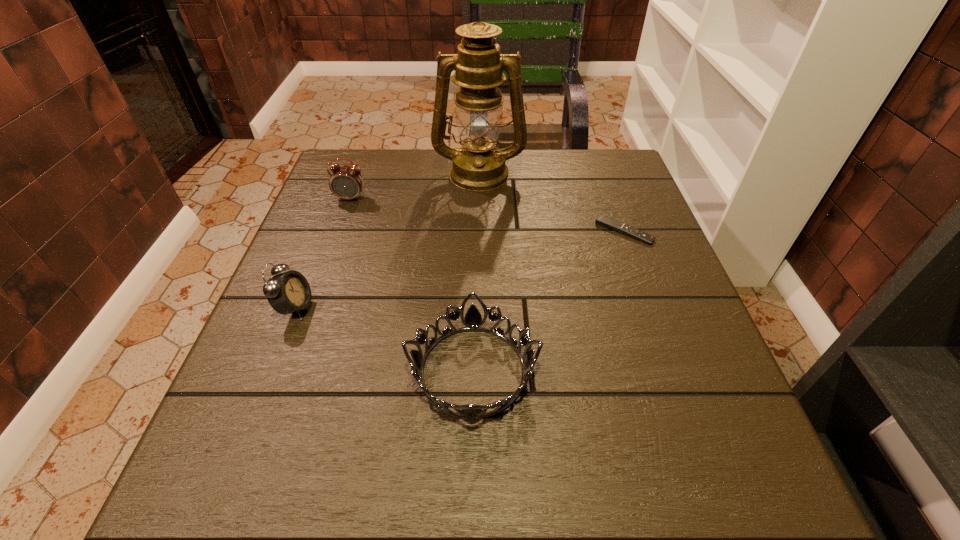
Locate an element on the screen. The height and width of the screenshot is (540, 960). free spot between the second shortest object and the tallest object is located at coordinates (476, 272).

Select which object appears as the third closest to the shortest object. Please provide its 2D coordinates. Your answer should be formatted as a tuple, i.e. [(x, y)], where the tuple contains the x and y coordinates of a point satisfying the conditions above.

[(346, 182)]

Choose which object is the fourth nearest neighbor to the tallest object. Please provide its 2D coordinates. Your answer should be formatted as a tuple, i.e. [(x, y)], where the tuple contains the x and y coordinates of a point satisfying the conditions above.

[(473, 321)]

Where is `blank space that satisfies the following two spatial constraints: 1. on the front side of the shortest object; 2. on the face of the nearer alarm clock`? blank space that satisfies the following two spatial constraints: 1. on the front side of the shortest object; 2. on the face of the nearer alarm clock is located at coordinates (652, 307).

Where is `vacant space that satisfies the following two spatial constraints: 1. on the face of the shortest object; 2. on the left side of the farther alarm clock`? vacant space that satisfies the following two spatial constraints: 1. on the face of the shortest object; 2. on the left side of the farther alarm clock is located at coordinates (339, 232).